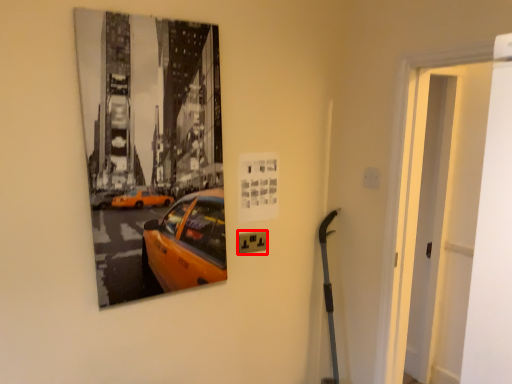
Question: In this image, where is electric outlet (annotated by the red box) located relative to door?

Choices:
 (A) right
 (B) left

Answer: (B)